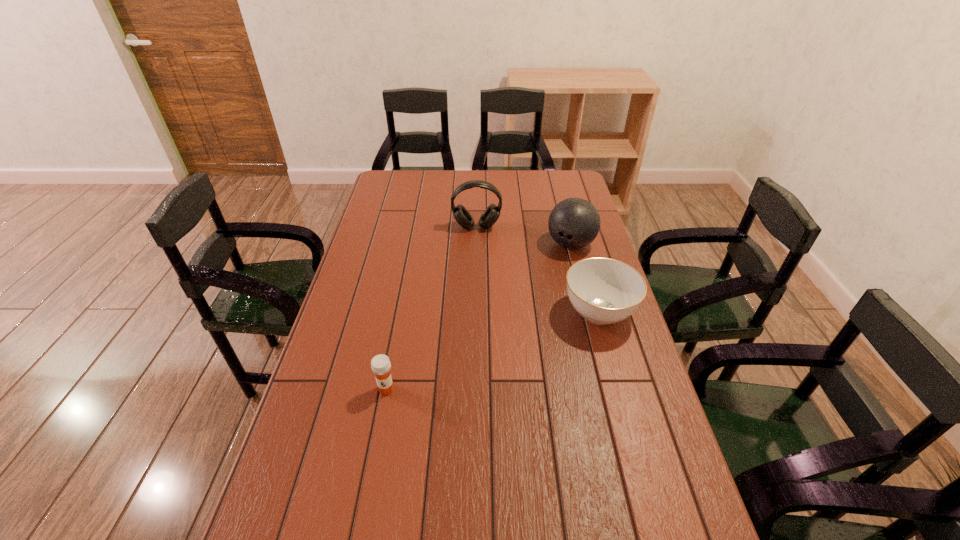
Image resolution: width=960 pixels, height=540 pixels. What are the coordinates of `vacant space on the desktop that is between the leftmost object and the third farthest object and is positioned on the earcups of the second object from left to right` in the screenshot? It's located at (482, 355).

At what (x,y) coordinates should I click in order to perform the action: click on free space on the desktop that is between the medicine and the third farthest object and is positioned on the grip area of the bowling ball. Please return your answer as a coordinate pair (x, y). Looking at the image, I should click on (504, 347).